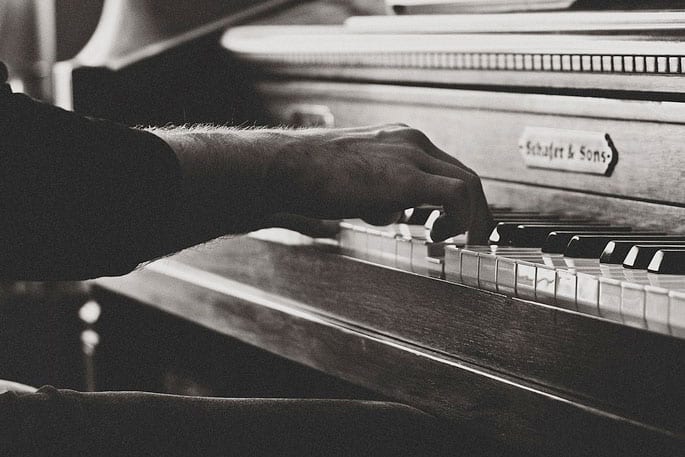
At what (x,y) coordinates should I click in order to perform the action: click on wooden piano. Please return your answer as a coordinate pair (x, y). Image resolution: width=685 pixels, height=457 pixels. Looking at the image, I should click on (464, 346).